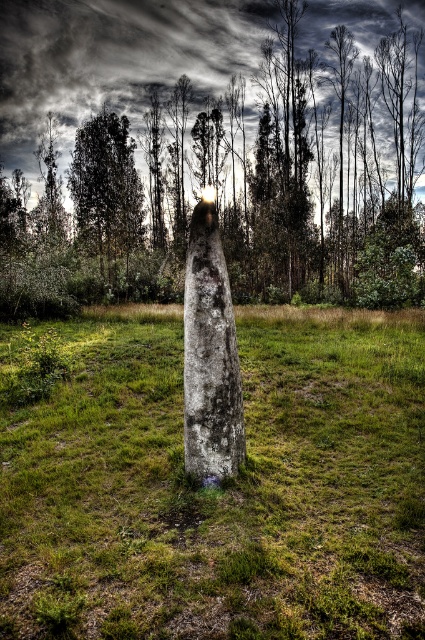
You are standing at the point with coordinates point (201, 244) and want to walk towards the point with coordinates point (112, 179). Which direction should you face to walk directly towards it?

You should face north because point (112, 179) is behind point (201, 244), meaning it is in the northern direction relative to your current position.

You are a gardener looking at the image. You need to place a new decorative rock between the smooth gray stone at center and the gray weathered stone at center. Where should you place it so it is between them?

Place the new decorative rock between the smooth gray stone at center and the gray weathered stone at center by positioning it to the right of the smooth gray stone at center and to the left of the gray weathered stone at center.